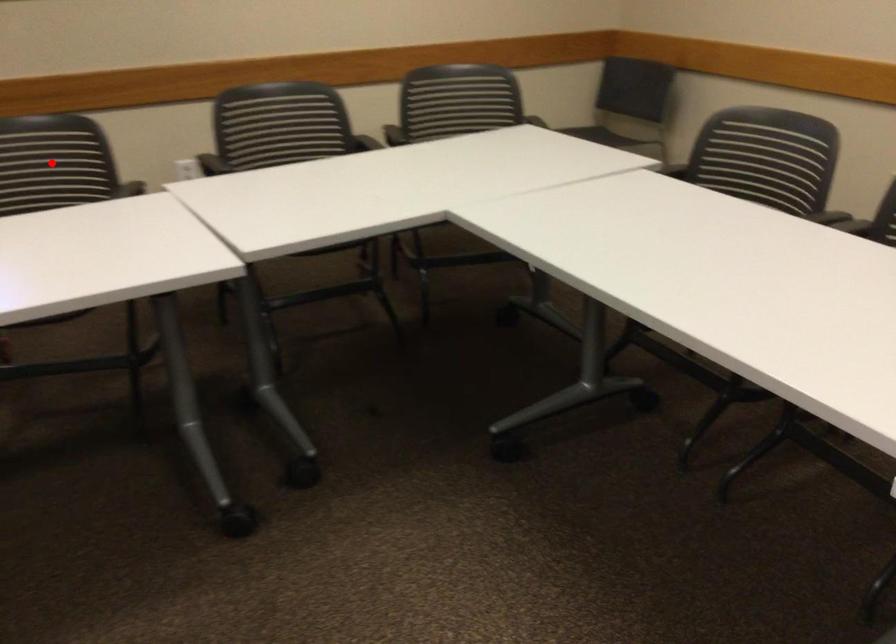
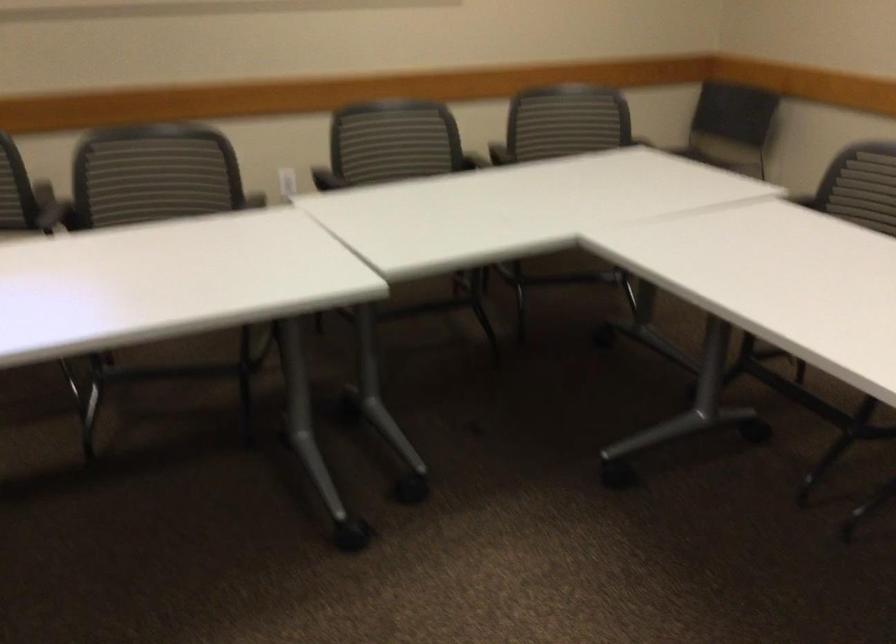
Question: I am providing you with two images of the same scene from different viewpoints. A red point is marked on the first image. At the location where the point appears in image 1, is it still visible in image 2?

Choices:
 (A) Yes
 (B) No

Answer: (B)